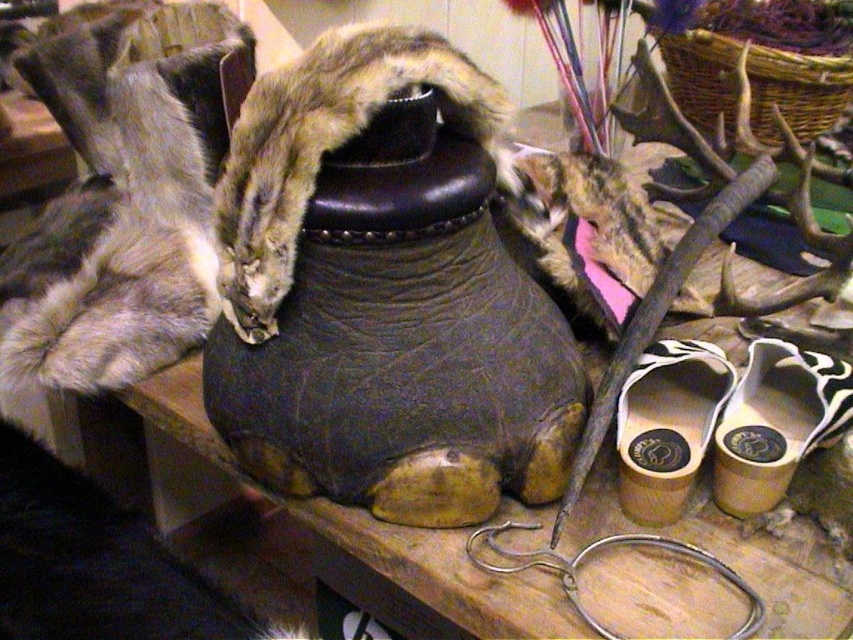
Can you confirm if white leather shoe at lower right is bigger than wooden shoe at lower right?

Correct, white leather shoe at lower right is larger in size than wooden shoe at lower right.

Can you confirm if white leather shoe at lower right is smaller than wooden shoe at lower right?

No, white leather shoe at lower right is not smaller than wooden shoe at lower right.

The image size is (853, 640). Identify the location of white leather shoe at lower right. (775, 422).